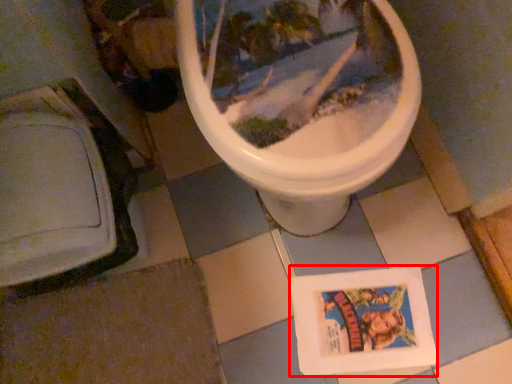
Question: Considering the relative positions of comic book (annotated by the red box) and tile in the image provided, where is comic book (annotated by the red box) located with respect to the staircase?

Choices:
 (A) right
 (B) left

Answer: (A)